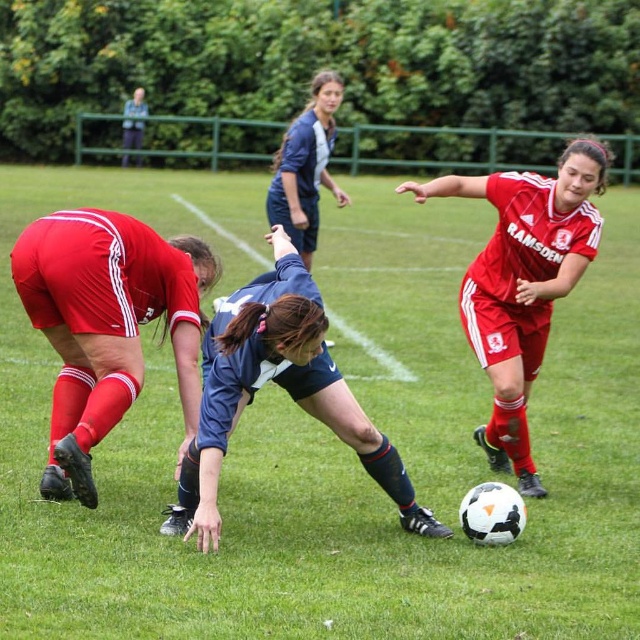
Question: Does green grass football field at center have a lesser width compared to navy blue jersey at center?

Choices:
 (A) yes
 (B) no

Answer: (B)

Question: Where is green grass football field at center located in relation to matte red shorts at lower left in the image?

Choices:
 (A) above
 (B) below

Answer: (A)

Question: Does green grass football field at center lie behind navy blue jersey at center?

Choices:
 (A) yes
 (B) no

Answer: (B)

Question: Based on their relative distances, which object is farther from the navy blue jersey at center?

Choices:
 (A) green grass football field at center
 (B) matte red shorts at lower left

Answer: (A)

Question: Which point is farther to the camera?

Choices:
 (A) (211, 362)
 (B) (179, 316)

Answer: (B)

Question: Which of the following is the closest to the observer?

Choices:
 (A) (410, 484)
 (B) (67, 339)
 (C) (404, 444)

Answer: (A)